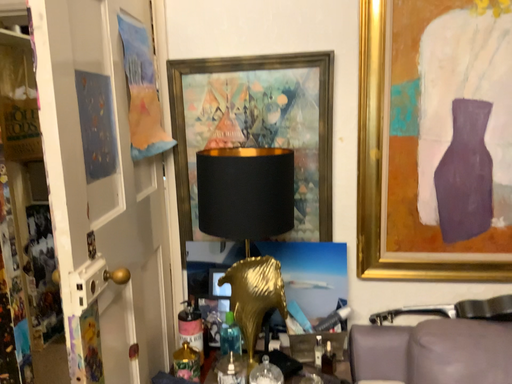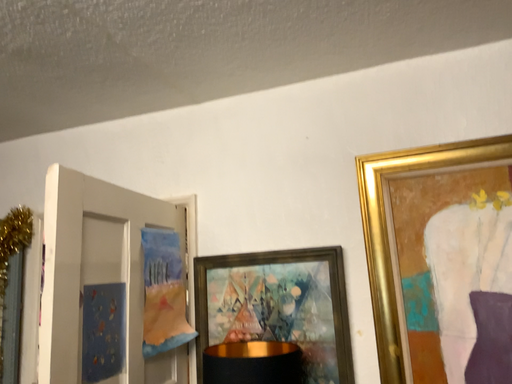
Question: How did the camera likely rotate when shooting the video?

Choices:
 (A) rotated downward
 (B) rotated upward

Answer: (B)